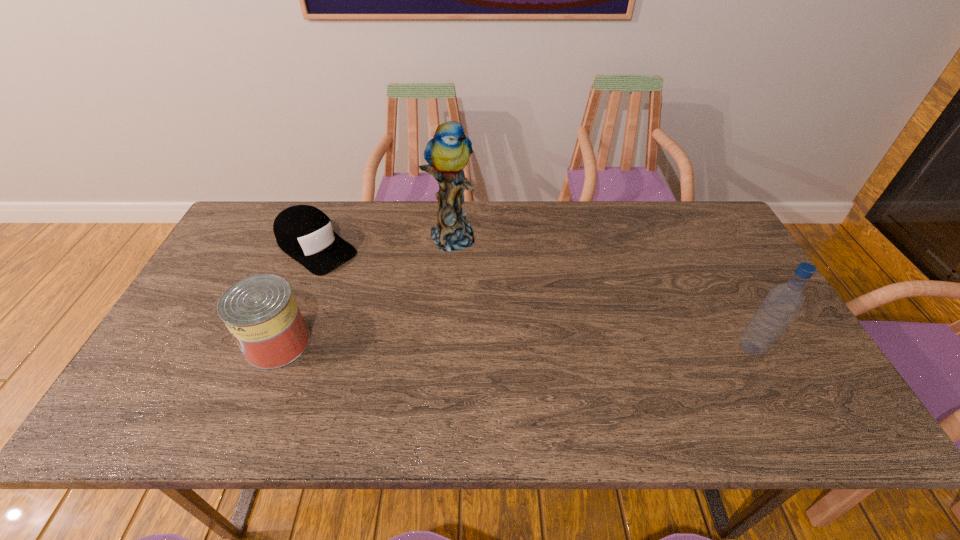
At what (x,y) coordinates should I click in order to perform the action: click on vacant position located on the face of the second object from right to left. Please return your answer as a coordinate pair (x, y). Looking at the image, I should click on (500, 308).

Locate an element on the screen. Image resolution: width=960 pixels, height=540 pixels. vacant space located on the front-facing side of the cap is located at coordinates (390, 301).

I want to click on vacant space located on the front-facing side of the cap, so click(x=375, y=291).

Find the location of a particular element. Image resolution: width=960 pixels, height=540 pixels. free space located on the front-facing side of the cap is located at coordinates (372, 288).

You are a GUI agent. You are given a task and a screenshot of the screen. Output one action in this format:
    pyautogui.click(x=<x>, y=<y>)
    Task: Click on the parrot that is at the far edge
    
    Given the screenshot: What is the action you would take?
    pyautogui.click(x=447, y=153)

Locate an element on the screen. The image size is (960, 540). cap that is at the far edge is located at coordinates (305, 233).

You are a GUI agent. You are given a task and a screenshot of the screen. Output one action in this format:
    pyautogui.click(x=<x>, y=<y>)
    Task: Click on the object located in the near edge section of the desktop
    
    Given the screenshot: What is the action you would take?
    pyautogui.click(x=261, y=313)

Image resolution: width=960 pixels, height=540 pixels. What are the coordinates of `object positioned at the left edge` in the screenshot? It's located at (305, 233).

Locate an element on the screen. This screenshot has height=540, width=960. object present at the right edge is located at coordinates (782, 303).

Find the location of a particular element. The height and width of the screenshot is (540, 960). object located in the far left corner section of the desktop is located at coordinates (305, 233).